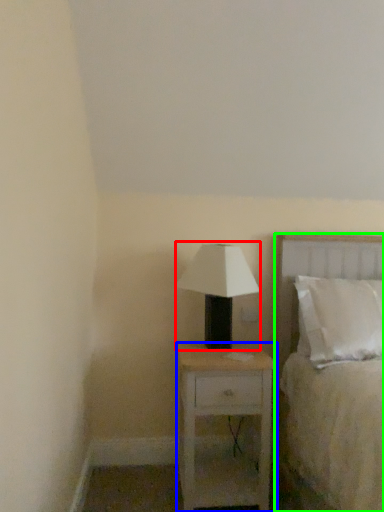
Question: Considering the real-world distances, which object is closest to table lamp (highlighted by a red box)? nightstand (highlighted by a blue box) or bed (highlighted by a green box).

Choices:
 (A) nightstand
 (B) bed

Answer: (A)